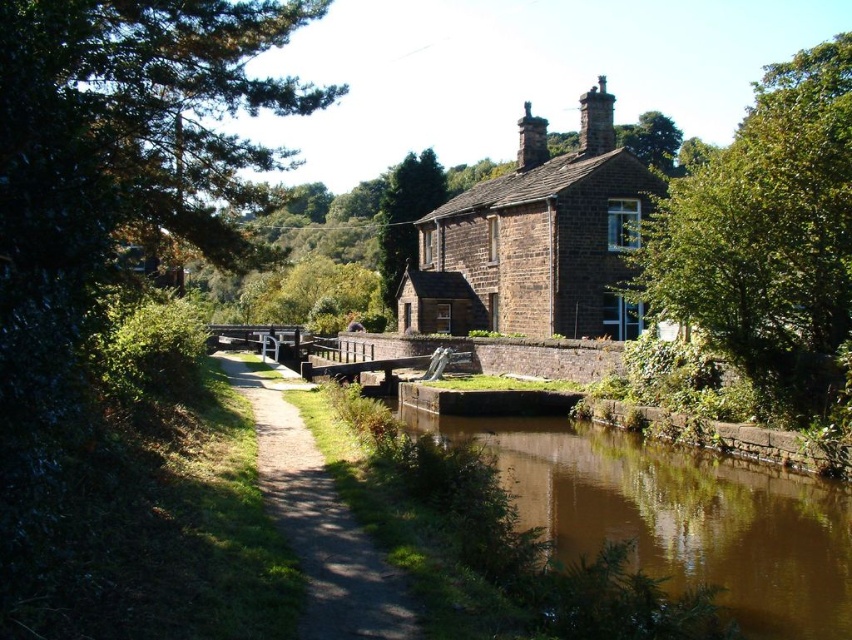
Can you confirm if brown stone cottage at center is smaller than brown gravel path at center?

Actually, brown stone cottage at center might be larger than brown gravel path at center.

This screenshot has height=640, width=852. What do you see at coordinates (536, 240) in the screenshot?
I see `brown stone cottage at center` at bounding box center [536, 240].

Locate an element on the screen. This screenshot has width=852, height=640. brown stone cottage at center is located at coordinates (536, 240).

Does brown stone canal at lower center have a greater width compared to green textured tree at upper center?

Correct, the width of brown stone canal at lower center exceeds that of green textured tree at upper center.

Is point (689, 515) positioned in front of point (406, 228)?

Yes, it is in front of point (406, 228).

Locate an element on the screen. This screenshot has height=640, width=852. brown stone canal at lower center is located at coordinates (675, 515).

Can you confirm if green leafy tree at left is bigger than green leafy tree at upper center?

No, green leafy tree at left is not bigger than green leafy tree at upper center.

This screenshot has width=852, height=640. Find the location of `green leafy tree at left`. green leafy tree at left is located at coordinates (108, 216).

Is point (45, 49) closer to viewer compared to point (643, 280)?

Yes.

This screenshot has width=852, height=640. Identify the location of green leafy tree at left. (108, 216).